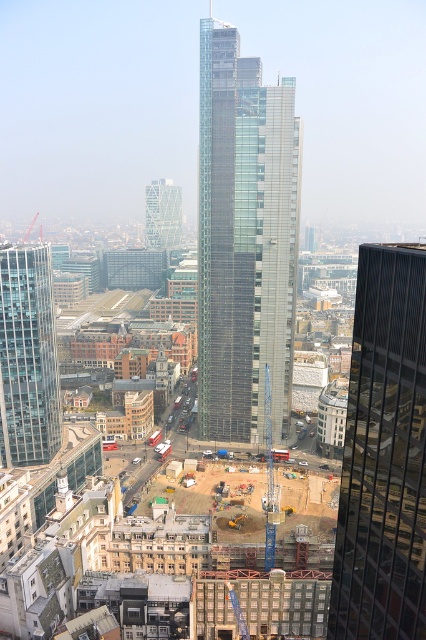
Question: Estimate the real-world distances between objects in this image. Which object is farther from the black glass skyscraper at right?

Choices:
 (A) transparent glass skyscraper at left
 (B) translucent glass tower at center
 (C) transparent glass skyscraper at center

Answer: (B)

Question: Can you confirm if black glass skyscraper at right is bigger than translucent glass tower at center?

Choices:
 (A) yes
 (B) no

Answer: (A)

Question: Among these points, which one is farthest from the camera?

Choices:
 (A) (360, 532)
 (B) (166, 218)
 (C) (40, 308)

Answer: (B)

Question: Where is black glass skyscraper at right located in relation to translucent glass tower at center in the image?

Choices:
 (A) above
 (B) below

Answer: (B)

Question: Which object is the farthest from the transparent glass skyscraper at center?

Choices:
 (A) translucent glass tower at center
 (B) transparent glass skyscraper at left
 (C) black glass skyscraper at right

Answer: (A)

Question: Observing the image, what is the correct spatial positioning of transparent glass skyscraper at center in reference to translucent glass tower at center?

Choices:
 (A) below
 (B) above

Answer: (A)